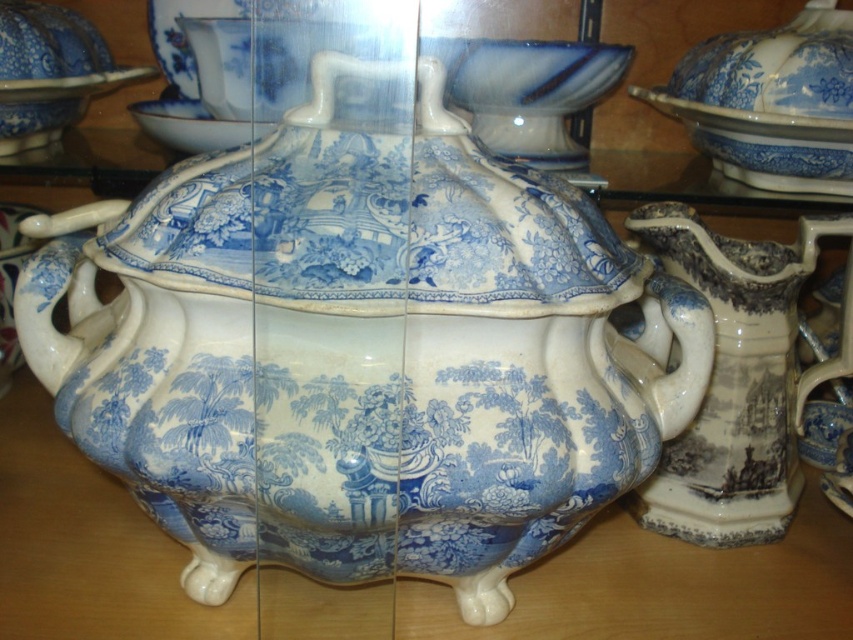
Does blue glazed teapot at center have a lesser height compared to blue and white ceramic pitcher at right?

Incorrect, blue glazed teapot at center's height does not fall short of blue and white ceramic pitcher at right's.

Who is shorter, blue glazed teapot at center or blue and white ceramic pitcher at right?

blue and white ceramic pitcher at right

Between point (144, 291) and point (762, 260), which one is positioned in front?

Point (144, 291) is in front.

You are a GUI agent. You are given a task and a screenshot of the screen. Output one action in this format:
    pyautogui.click(x=<x>, y=<y>)
    Task: Click on the blue glazed teapot at center
    The image size is (853, 640).
    Given the screenshot: What is the action you would take?
    click(x=361, y=349)

Is blue glazed teapot at center to the right of blue glazed plate at upper left from the viewer's perspective?

Yes, blue glazed teapot at center is to the right of blue glazed plate at upper left.

Is blue glazed teapot at center bigger than blue glazed plate at upper left?

Indeed, blue glazed teapot at center has a larger size compared to blue glazed plate at upper left.

Who is more distant from viewer, (16, 324) or (38, 84)?

Positioned behind is point (38, 84).

Locate an element on the screen. This screenshot has width=853, height=640. blue glazed teapot at center is located at coordinates (361, 349).

Can you confirm if blue and white ceramic pitcher at right is positioned to the left of blue glazed plate at upper left?

In fact, blue and white ceramic pitcher at right is to the right of blue glazed plate at upper left.

Which is behind, point (705, 458) or point (67, 90)?

The point (67, 90) is more distant.

Which is behind, point (718, 476) or point (55, 81)?

The point (55, 81) is more distant.

At what (x,y) coordinates should I click in order to perform the action: click on blue and white ceramic pitcher at right. Please return your answer as a coordinate pair (x, y). The height and width of the screenshot is (640, 853). Looking at the image, I should click on (738, 380).